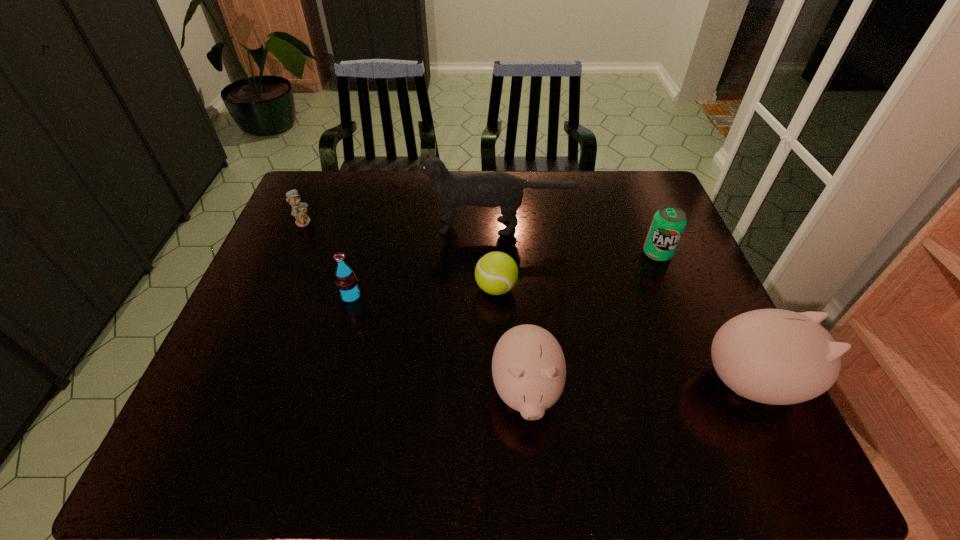
Locate an element on the screen. The image size is (960, 540). object at the near right corner is located at coordinates (773, 356).

Locate an element on the screen. Image resolution: width=960 pixels, height=540 pixels. free region at the far edge of the desktop is located at coordinates (481, 171).

Locate an element on the screen. This screenshot has height=540, width=960. vacant space at the near edge of the desktop is located at coordinates (438, 404).

This screenshot has height=540, width=960. In the image, there is a desktop. What are the coordinates of `free space at the left edge` in the screenshot? It's located at (293, 300).

Identify the location of free space at the right edge. The image size is (960, 540). (689, 292).

Locate an element on the screen. Image resolution: width=960 pixels, height=540 pixels. vacant space at the far left corner of the desktop is located at coordinates (342, 204).

Locate an element on the screen. vacant position at the near left corner of the desktop is located at coordinates (266, 401).

Identify the location of vacant area that lies between the shorter piggy bank and the taller piggy bank. Image resolution: width=960 pixels, height=540 pixels. (640, 388).

Where is `free spot between the taller piggy bank and the third farthest object`? The height and width of the screenshot is (540, 960). free spot between the taller piggy bank and the third farthest object is located at coordinates (707, 319).

Where is `free area in between the left piggy bank and the fifth nearest object`? The image size is (960, 540). free area in between the left piggy bank and the fifth nearest object is located at coordinates (591, 323).